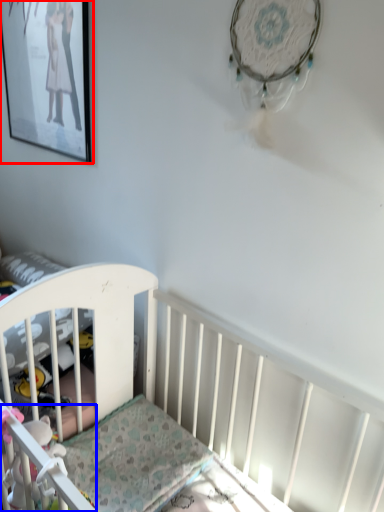
Question: Which of the following is the closest to the observer, picture frame (highlighted by a red box) or toy (highlighted by a blue box)?

Choices:
 (A) picture frame
 (B) toy

Answer: (B)